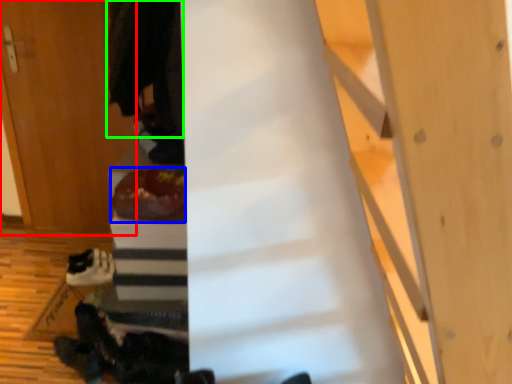
Question: Based on their relative distances, which object is nearer to door (highlighted by a red box)? Choose from food (highlighted by a blue box) and robe (highlighted by a green box).

Choices:
 (A) food
 (B) robe

Answer: (B)